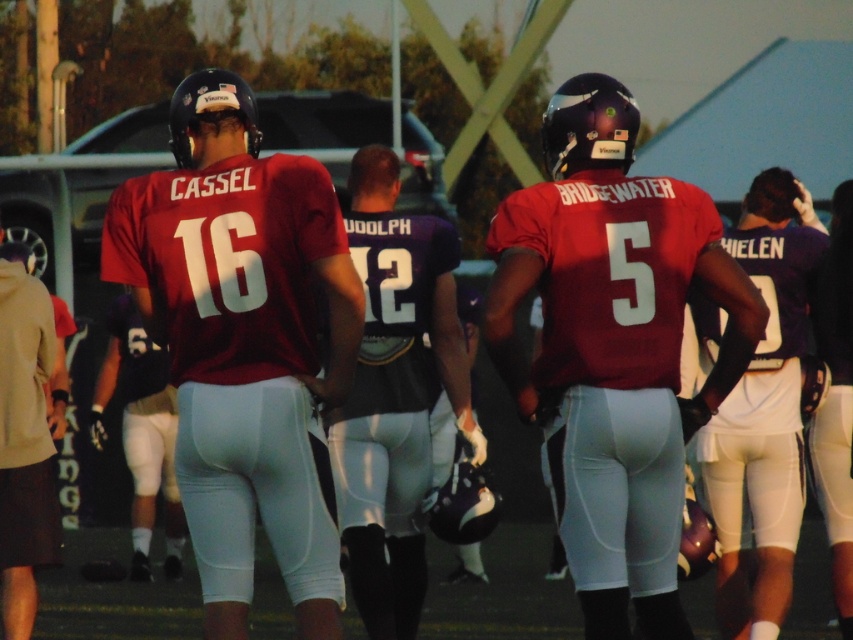
You are a sports analyst watching the game. You notice a point marked at coordinates (242,340). What object is located at this point?

The point at coordinates (242,340) corresponds to the matte maroon jersey at center.

You are a sports analyst watching the game. You notice two players wearing matte maroon jersey at center and matte red jersey at center. Which player is wearing a narrower jersey?

The matte maroon jersey at center has a lesser width compared to the matte red jersey at center, so the player wearing the matte maroon jersey at center is wearing a narrower one.

From the picture: You are a photographer standing at the center of the field. You want to take a photo of the matte maroon jersey at center. Which direction should you move to get a better shot?

The matte maroon jersey at center is located at point (x=242, y=340), so you should move slightly to the right and forward to center it in your viewfinder.